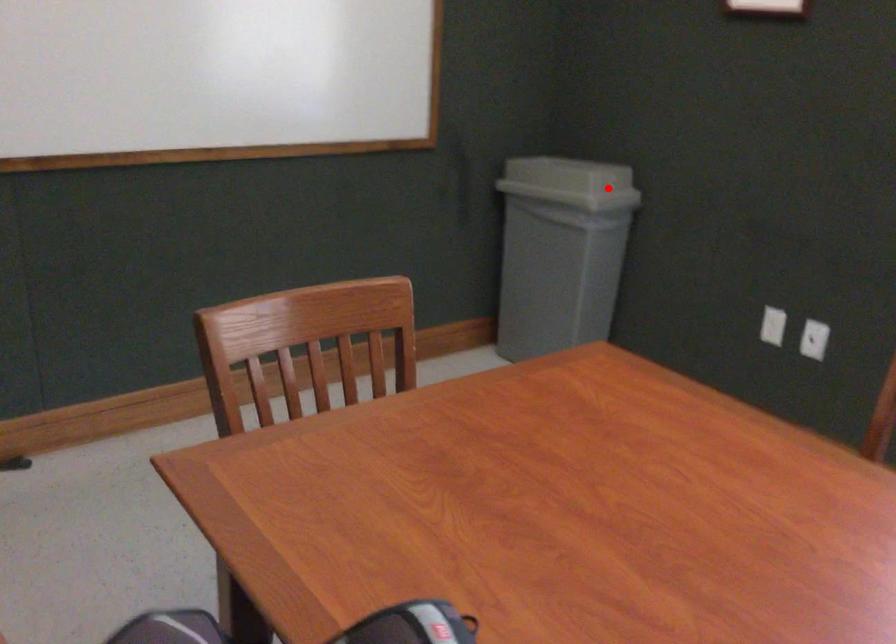
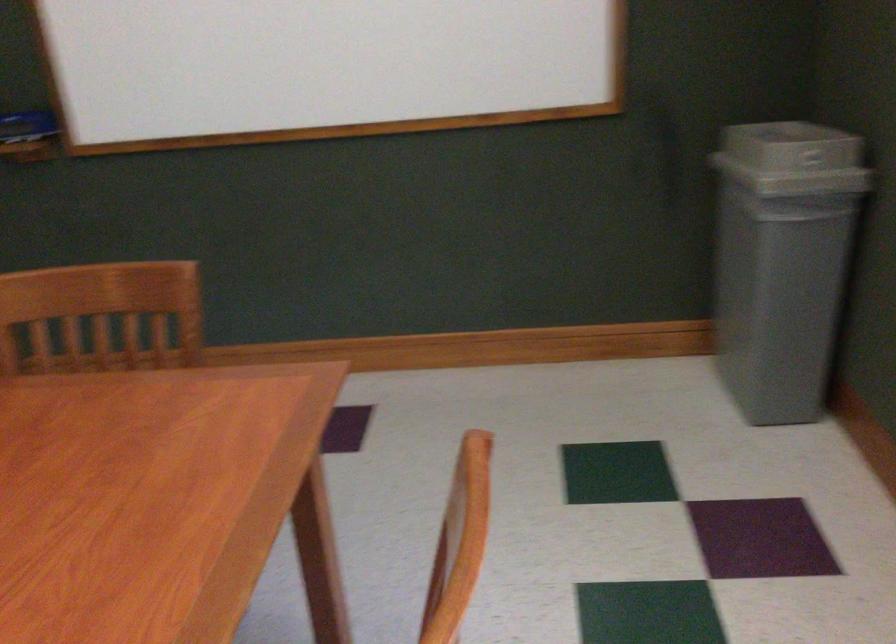
Question: I am providing you with two images of the same scene from different viewpoints. A red point is shown in image1. For the corresponding object point in image2, is it positioned nearer or farther from the camera?

Choices:
 (A) Nearer
 (B) Farther

Answer: (A)